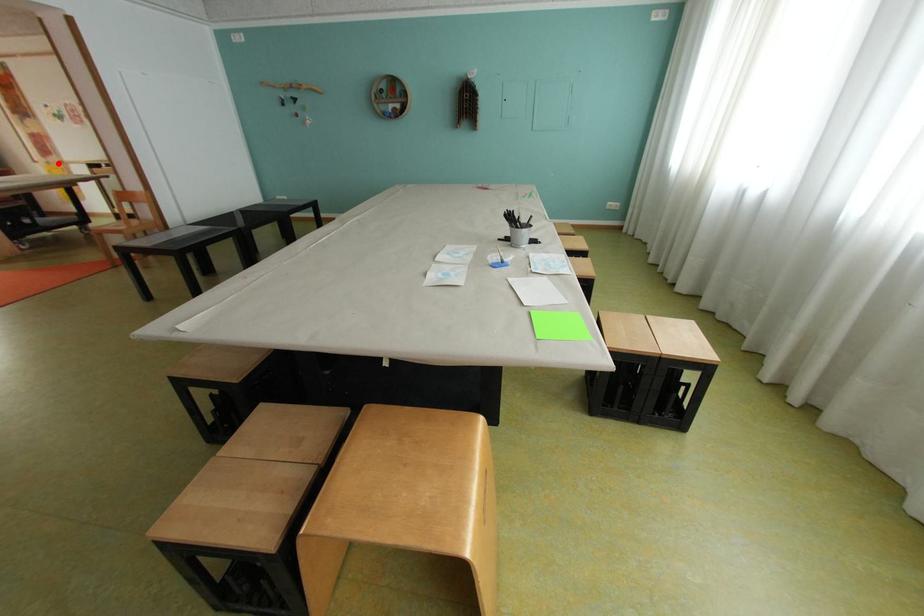
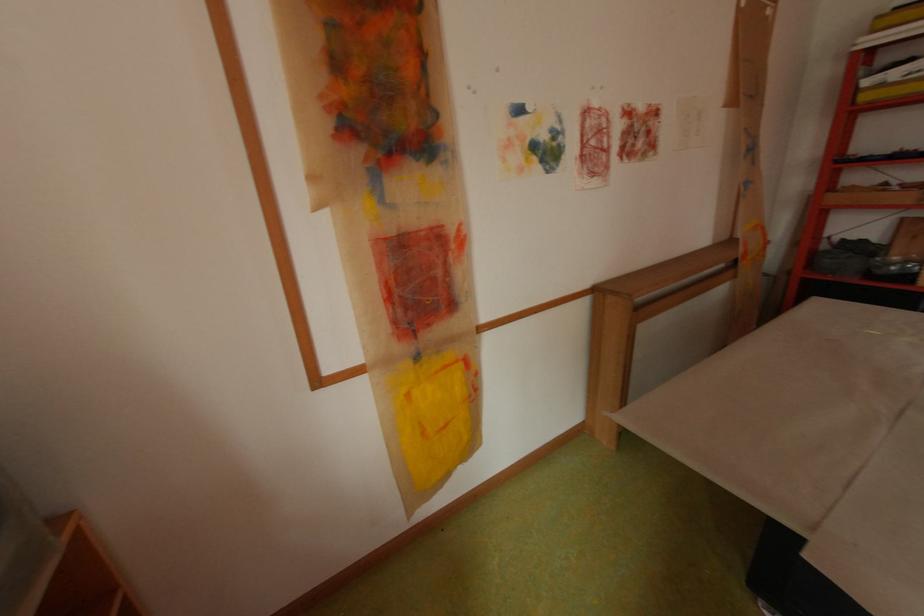
Where in the second image is the point corresponding to the highlighted location from the first image?

(429, 358)